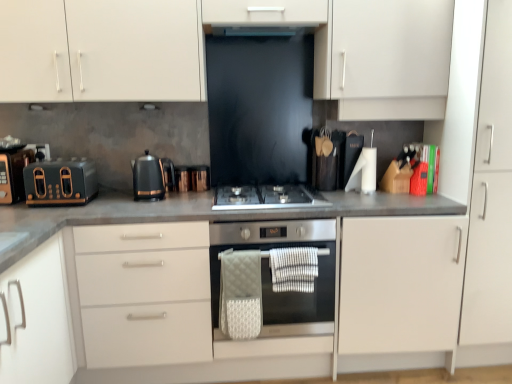
Where is `space that is in front of matte black toaster at left, the first kitchen appliance from the left`? This screenshot has width=512, height=384. space that is in front of matte black toaster at left, the first kitchen appliance from the left is located at coordinates (50, 217).